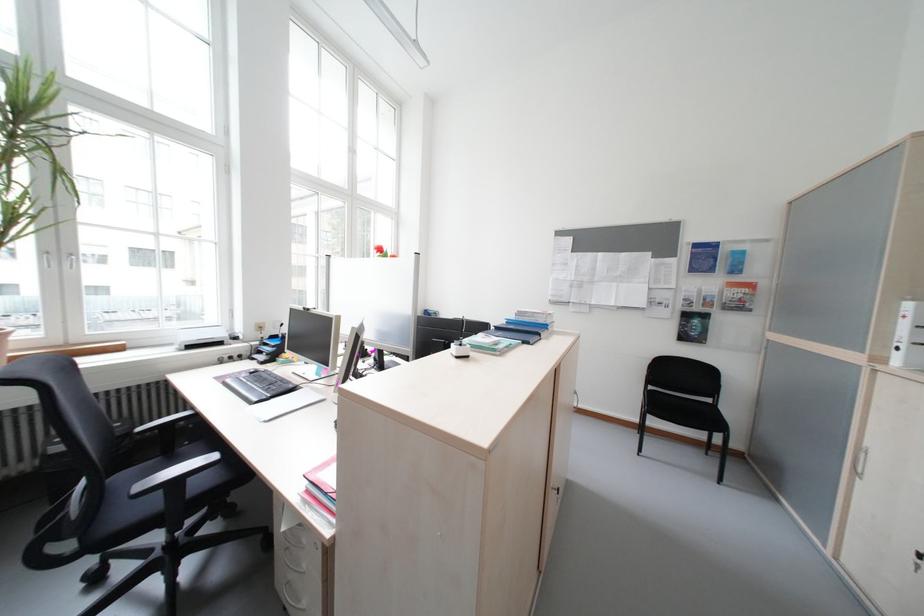
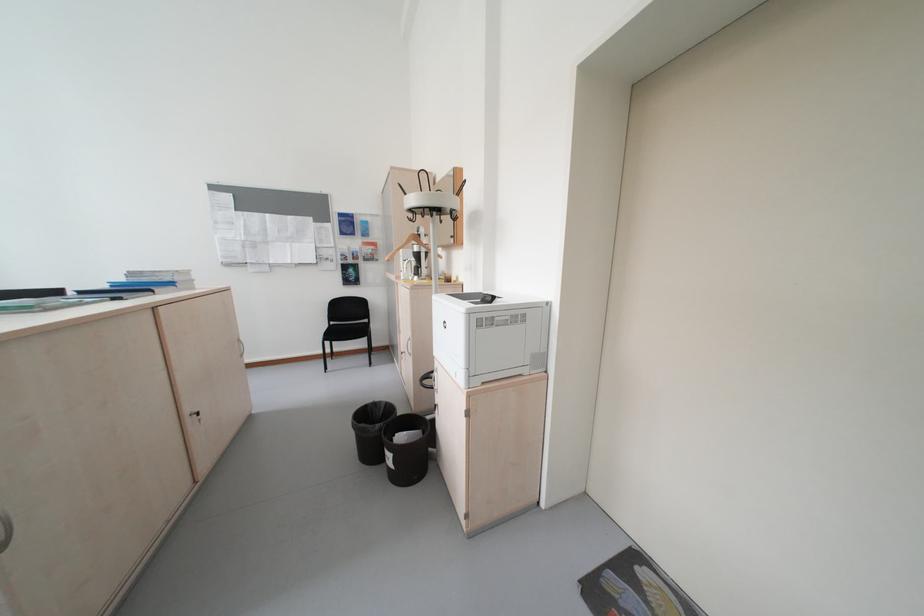
Question: The camera is either moving clockwise (left) or counter-clockwise (right) around the object. The first image is from the beginning of the video and the second image is from the end. Is the camera moving left or right when shooting the video?

Choices:
 (A) Left
 (B) Right

Answer: (A)